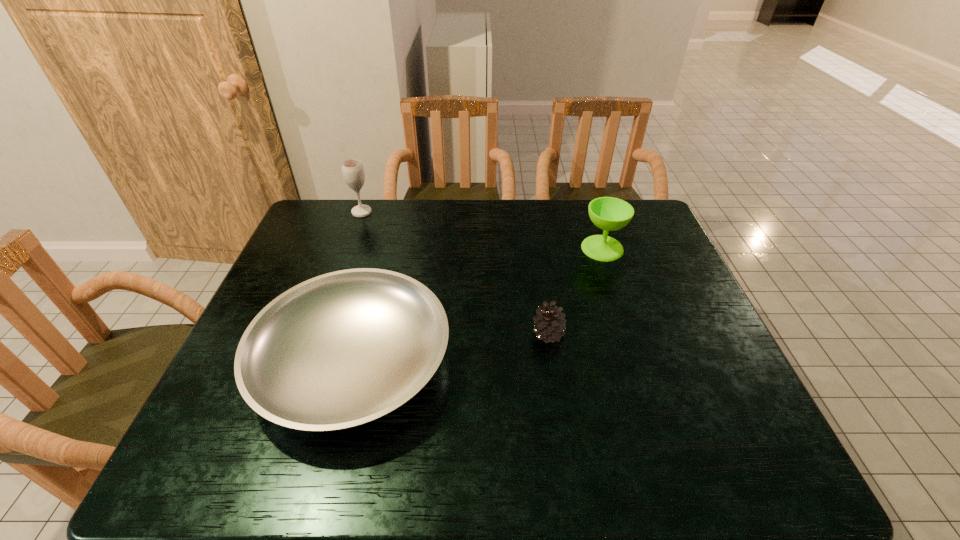
Find the location of a particular element. vacant area between the taller wineglass and the pinecone is located at coordinates (455, 273).

This screenshot has width=960, height=540. Find the location of `vacant space in between the farther wineglass and the pinecone`. vacant space in between the farther wineglass and the pinecone is located at coordinates (455, 273).

Image resolution: width=960 pixels, height=540 pixels. I want to click on free area in between the right wineglass and the farthest object, so click(482, 230).

Find the location of `free space between the nearer wineglass and the bedpan`. free space between the nearer wineglass and the bedpan is located at coordinates (478, 305).

Identify which object is located as the nearest to the second tallest object. Please provide its 2D coordinates. Your answer should be formatted as a tuple, i.e. [(x, y)], where the tuple contains the x and y coordinates of a point satisfying the conditions above.

[(550, 327)]

Identify which object is the nearest to the tallest object. Please provide its 2D coordinates. Your answer should be formatted as a tuple, i.e. [(x, y)], where the tuple contains the x and y coordinates of a point satisfying the conditions above.

[(340, 350)]

You are a GUI agent. You are given a task and a screenshot of the screen. Output one action in this format:
    pyautogui.click(x=<x>, y=<y>)
    Task: Click on the vacant area in the image that satisfies the following two spatial constraints: 1. on the back side of the third nearest object; 2. on the left side of the shortest object
    The width and height of the screenshot is (960, 540).
    Given the screenshot: What is the action you would take?
    pyautogui.click(x=383, y=248)